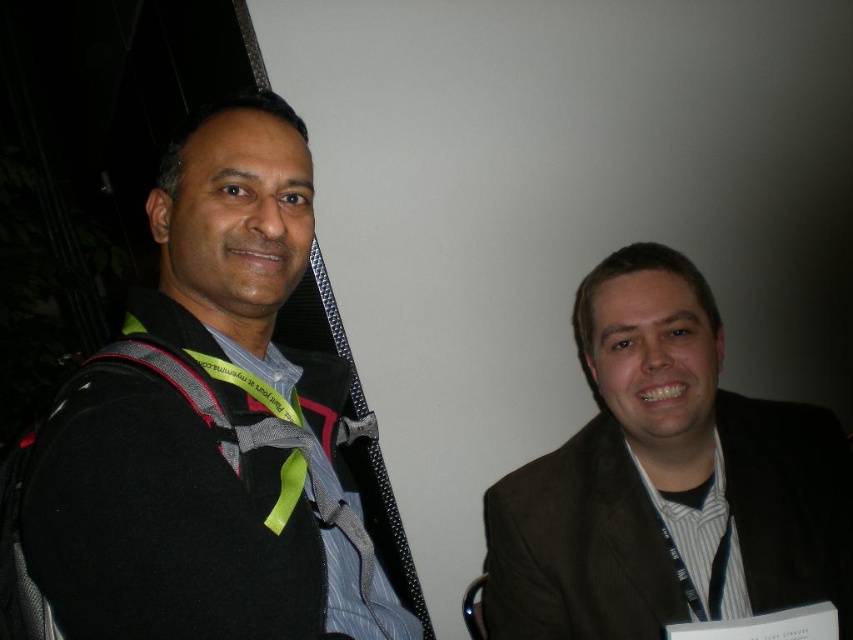
Question: Does black fabric backpack at left come in front of brown textured suit at right?

Choices:
 (A) yes
 (B) no

Answer: (A)

Question: Which object is closer to the camera taking this photo?

Choices:
 (A) black fabric backpack at left
 (B) brown textured suit at right

Answer: (A)

Question: Does black fabric backpack at left have a larger size compared to brown textured suit at right?

Choices:
 (A) yes
 (B) no

Answer: (A)

Question: Which object is closer to the camera taking this photo?

Choices:
 (A) brown textured suit at right
 (B) black fabric backpack at left

Answer: (B)

Question: Which of the following is the closest to the observer?

Choices:
 (A) black fabric backpack at left
 (B) brown textured suit at right

Answer: (A)

Question: Is the position of black fabric backpack at left more distant than that of brown textured suit at right?

Choices:
 (A) yes
 (B) no

Answer: (B)